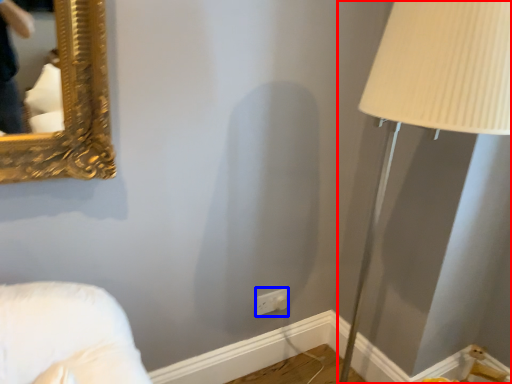
Question: Which object appears closest to the camera in this image, table lamp (highlighted by a red box) or electric outlet (highlighted by a blue box)?

Choices:
 (A) table lamp
 (B) electric outlet

Answer: (A)